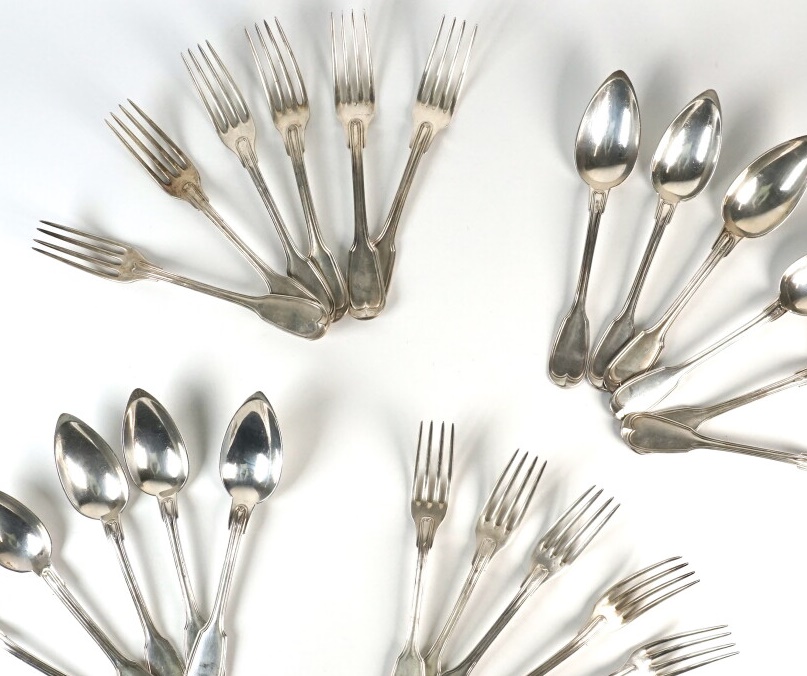
What are the coordinates of `spoons` in the screenshot? It's located at (40, 556), (95, 500), (160, 470), (228, 468), (591, 153), (672, 149), (784, 210), (774, 387), (768, 450), (30, 660).